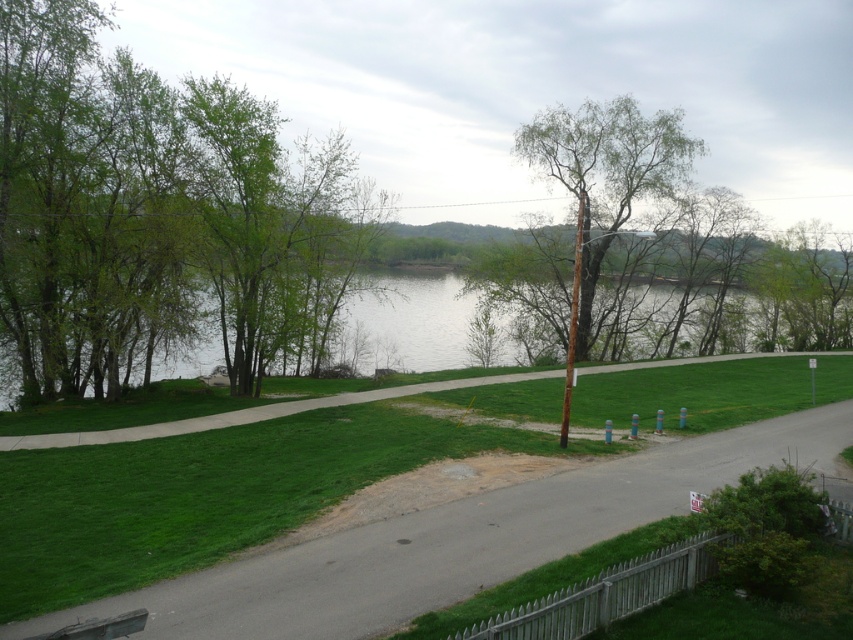
Is green leafy trees at left positioned at the back of green water at center?

No, it is in front of green water at center.

Which of these two, green leafy trees at left or green water at center, stands taller?

Standing taller between the two is green leafy trees at left.

Is point (84, 35) less distant than point (440, 294)?

Yes, point (84, 35) is in front of point (440, 294).

Locate an element on the screen. The height and width of the screenshot is (640, 853). green leafy trees at left is located at coordinates (155, 216).

Is green leafy tree at center taller than green water at center?

Yes.

Who is more forward, (601, 228) or (506, 353)?

Positioned in front is point (601, 228).

Image resolution: width=853 pixels, height=640 pixels. Describe the element at coordinates (608, 154) in the screenshot. I see `green leafy tree at center` at that location.

You are a GUI agent. You are given a task and a screenshot of the screen. Output one action in this format:
    pyautogui.click(x=<x>, y=<y>)
    Task: Click on the green leafy tree at center
    Image resolution: width=853 pixels, height=640 pixels.
    Given the screenshot: What is the action you would take?
    pyautogui.click(x=608, y=154)

Who is more forward, (86, 376) or (244, 637)?

Point (244, 637) is in front.

Can you confirm if green leafy trees at left is positioned to the left of gray asphalt road at center?

Yes, green leafy trees at left is to the left of gray asphalt road at center.

What are the coordinates of `green leafy trees at left` in the screenshot? It's located at (155, 216).

At what (x,y) coordinates should I click in order to perform the action: click on green leafy trees at left. Please return your answer as a coordinate pair (x, y). This screenshot has width=853, height=640. Looking at the image, I should click on (155, 216).